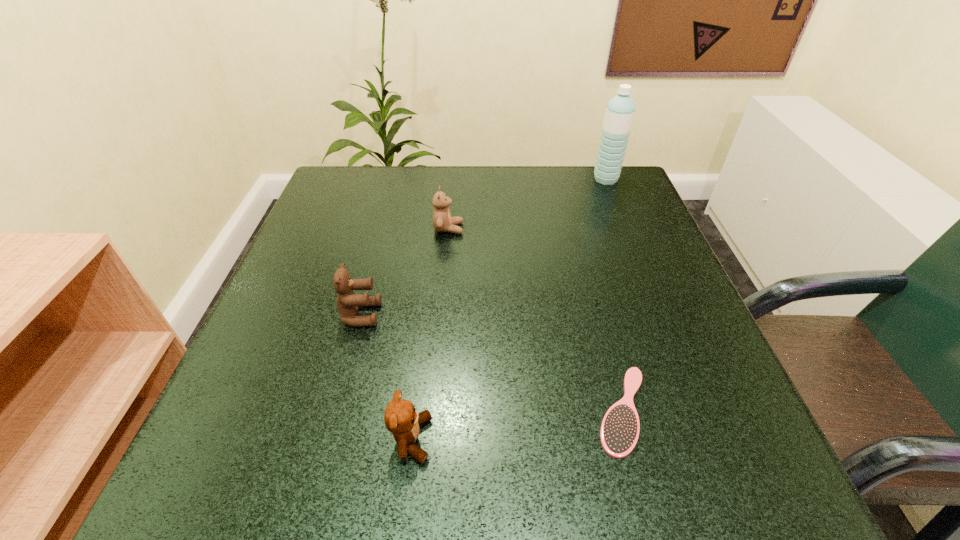
I want to click on empty space that is in between the second object from right to left and the water bottle, so click(614, 295).

Find the location of `empty location between the farthest teddy bear and the tallest object`. empty location between the farthest teddy bear and the tallest object is located at coordinates (527, 204).

Where is `unoccupied position between the second farthest teddy bear and the water bottle`? This screenshot has height=540, width=960. unoccupied position between the second farthest teddy bear and the water bottle is located at coordinates [x=483, y=247].

This screenshot has width=960, height=540. Identify the location of vacant area that lies between the farthest object and the fourth nearest object. (527, 204).

The width and height of the screenshot is (960, 540). What are the coordinates of `unoccupied area between the fourth object from left to right and the farthest teddy bear` in the screenshot? It's located at (536, 319).

This screenshot has width=960, height=540. I want to click on vacant space in between the nearest teddy bear and the leftmost object, so click(x=386, y=377).

Identify the location of unoccupied position between the leftmost object and the farthest teddy bear. The height and width of the screenshot is (540, 960). (405, 272).

I want to click on free spot between the shortest object and the fourth nearest object, so click(536, 319).

Choose which object is the fourth nearest neighbor to the tallest object. Please provide its 2D coordinates. Your answer should be formatted as a tuple, i.e. [(x, y)], where the tuple contains the x and y coordinates of a point satisfying the conditions above.

[(400, 418)]

Where is `object that stands as the third closest to the second object from right to left`? object that stands as the third closest to the second object from right to left is located at coordinates (442, 221).